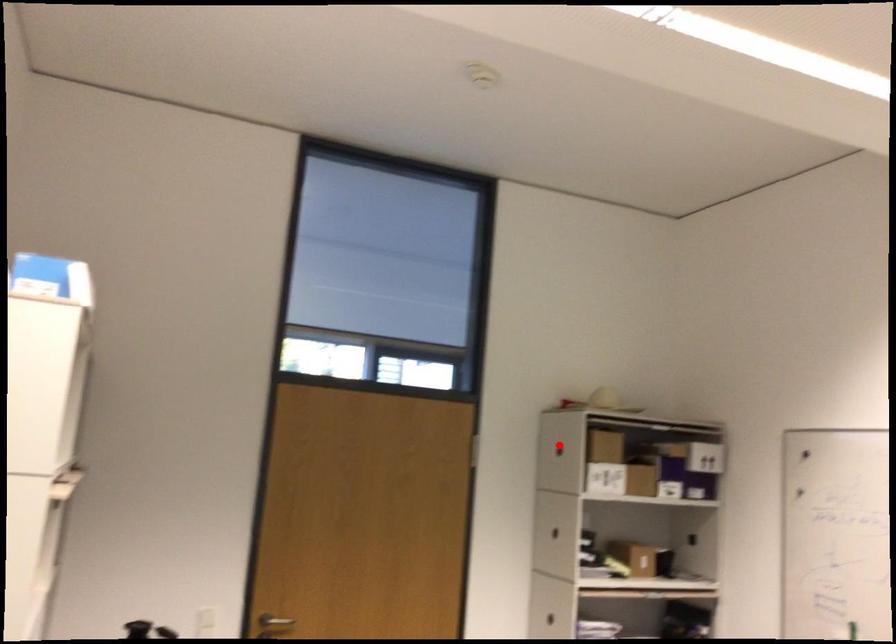
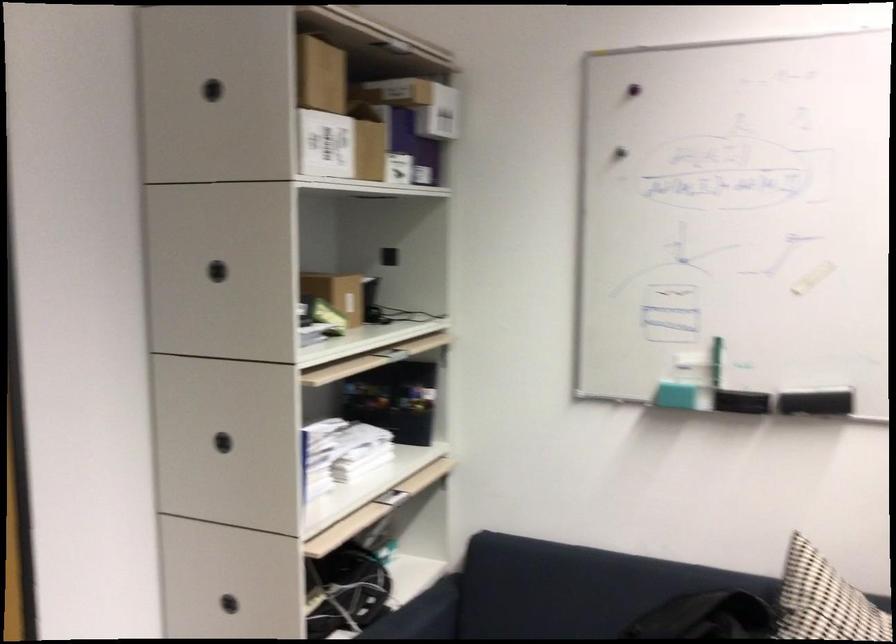
Question: I am providing you with two images of the same scene from different viewpoints. A red point is shown in image1. For the corresponding object point in image2, is it positioned nearer or farther from the camera?

Choices:
 (A) Nearer
 (B) Farther

Answer: (A)